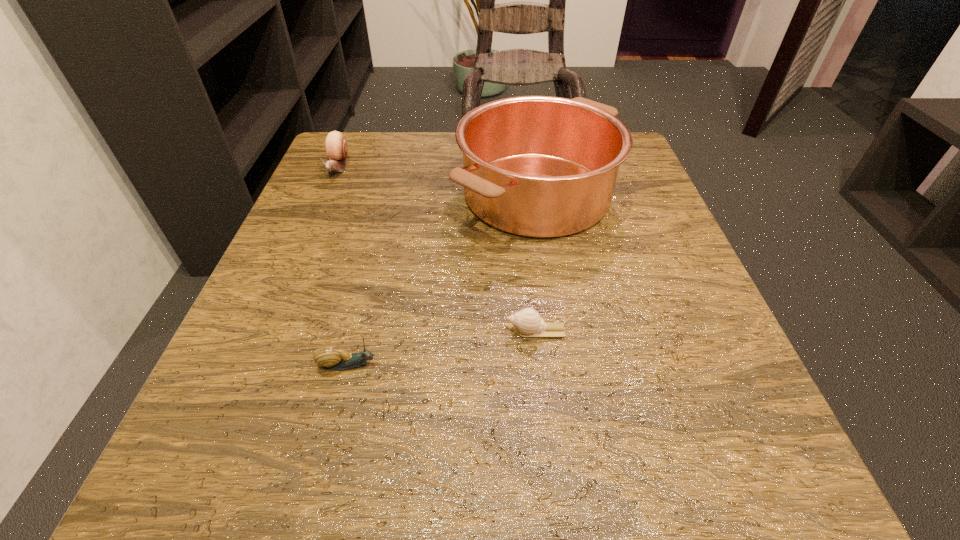
Image resolution: width=960 pixels, height=540 pixels. Find the location of `free space at the right edge of the desktop`. free space at the right edge of the desktop is located at coordinates (621, 202).

Identify the location of free space at the far left corner. (375, 164).

In order to click on free space between the nearest object and the tallest escargot in this screenshot , I will do `click(344, 266)`.

Find the location of a particular element. vacant area that lies between the second farthest escargot and the nearest escargot is located at coordinates (444, 348).

Where is `free space between the rightmost escargot and the nearest object`? Image resolution: width=960 pixels, height=540 pixels. free space between the rightmost escargot and the nearest object is located at coordinates (444, 348).

Identify the location of vacant space that is in between the second tallest object and the second escargot from right to left. Image resolution: width=960 pixels, height=540 pixels. (344, 266).

Locate an element on the screen. This screenshot has width=960, height=540. unoccupied area between the tallest object and the rightmost escargot is located at coordinates (537, 262).

Image resolution: width=960 pixels, height=540 pixels. Identify the location of vacant area that lies between the leftmost escargot and the saucepan. (x=437, y=180).

Where is `free spot between the farthest escargot and the saucepan`? The width and height of the screenshot is (960, 540). free spot between the farthest escargot and the saucepan is located at coordinates pyautogui.click(x=437, y=180).

Find the location of `vacant space in between the saucepan and the leftmost escargot`. vacant space in between the saucepan and the leftmost escargot is located at coordinates (437, 180).